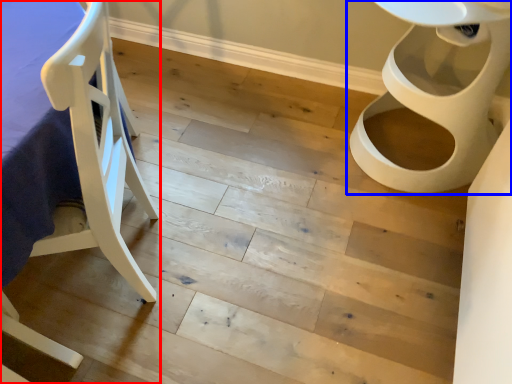
Question: Among these objects, which one is farthest to the camera, furniture (highlighted by a red box) or toilet (highlighted by a blue box)?

Choices:
 (A) furniture
 (B) toilet

Answer: (B)